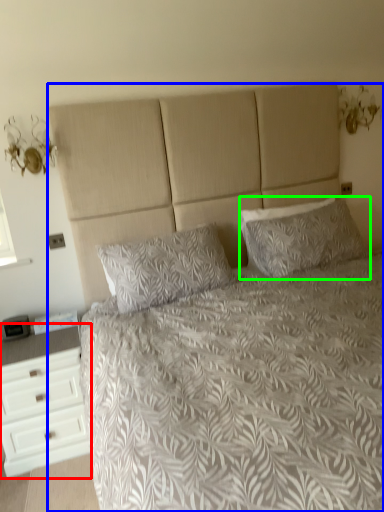
Question: Estimate the real-world distances between objects in this image. Which object is farther from chest of drawers (highlighted by a red box), bed (highlighted by a blue box) or pillow (highlighted by a green box)?

Choices:
 (A) bed
 (B) pillow

Answer: (B)